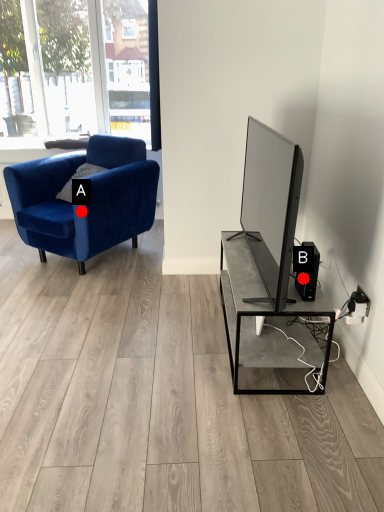
Question: Two points are circled on the image, labeled by A and B beside each circle. Which point is further to the camera?

Choices:
 (A) A is further
 (B) B is further

Answer: (A)